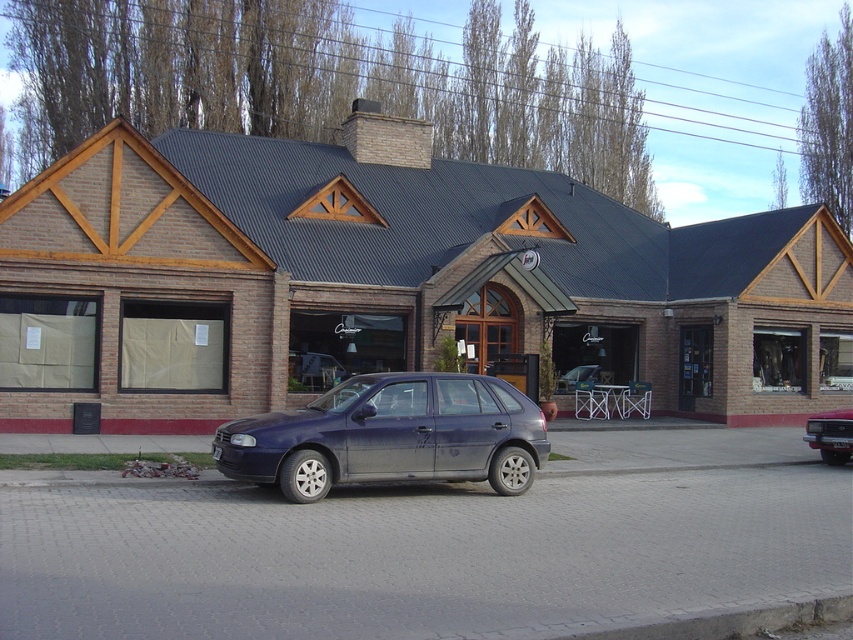
Question: Does slate metallic car at center appear under satin silver sedan at center?

Choices:
 (A) no
 (B) yes

Answer: (B)

Question: Which object is farther from the camera taking this photo?

Choices:
 (A) brick building at center
 (B) slate metallic car at center
 (C) metallic silver car at center

Answer: (A)

Question: Is brick building at center below slate metallic car at center?

Choices:
 (A) yes
 (B) no

Answer: (B)

Question: Which point is farther to the camera?

Choices:
 (A) (320, 440)
 (B) (596, 381)
 (C) (817, 445)

Answer: (B)

Question: Is metallic silver car at center thinner than satin silver sedan at center?

Choices:
 (A) yes
 (B) no

Answer: (A)

Question: Based on their relative distances, which object is farther from the brick building at center?

Choices:
 (A) metallic silver car at center
 (B) slate metallic car at center

Answer: (A)